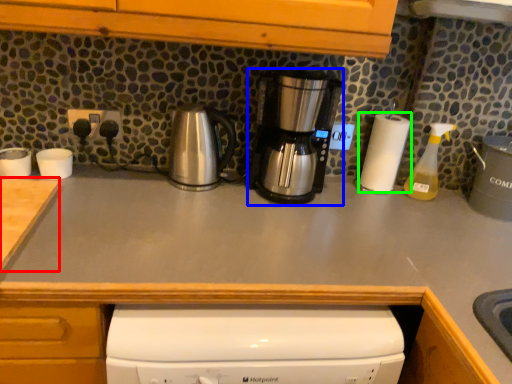
Question: Which is nearer to the counter top (highlighted by a red box)? kitchen appliance (highlighted by a blue box) or paper towel (highlighted by a green box).

Choices:
 (A) kitchen appliance
 (B) paper towel

Answer: (A)